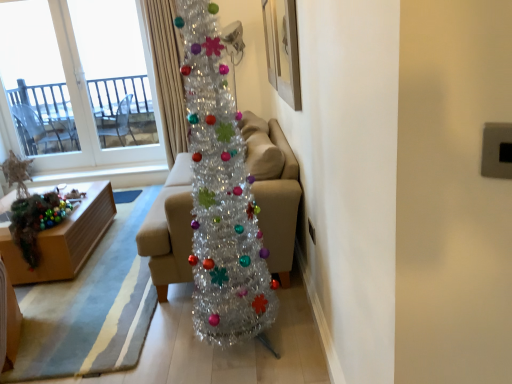
Question: Is beige fabric couch at center to the left of wooden picture frame at upper center from the viewer's perspective?

Choices:
 (A) no
 (B) yes

Answer: (B)

Question: Can you confirm if beige fabric couch at center is positioned to the right of wooden picture frame at upper center?

Choices:
 (A) yes
 (B) no

Answer: (B)

Question: Is beige fabric couch at center positioned beyond the bounds of wooden picture frame at upper center?

Choices:
 (A) no
 (B) yes

Answer: (B)

Question: Is beige fabric couch at center bigger than wooden picture frame at upper center?

Choices:
 (A) no
 (B) yes

Answer: (B)

Question: Does beige fabric couch at center contain wooden picture frame at upper center?

Choices:
 (A) yes
 (B) no

Answer: (B)

Question: In the image, is wooden picture frame at upper center positioned in front of or behind silky beige curtain at upper center?

Choices:
 (A) behind
 (B) front

Answer: (B)

Question: Visually, is wooden picture frame at upper center positioned to the left or to the right of silky beige curtain at upper center?

Choices:
 (A) right
 (B) left

Answer: (A)

Question: From the image's perspective, is wooden picture frame at upper center positioned above or below silky beige curtain at upper center?

Choices:
 (A) above
 (B) below

Answer: (B)

Question: Looking at the image, does wooden picture frame at upper center seem bigger or smaller compared to silky beige curtain at upper center?

Choices:
 (A) small
 (B) big

Answer: (A)

Question: Is point (272, 51) closer or farther from the camera than point (86, 248)?

Choices:
 (A) farther
 (B) closer

Answer: (B)

Question: Which is correct: wooden picture frame at upper center is inside wooden box at lower left, or outside of it?

Choices:
 (A) inside
 (B) outside

Answer: (B)

Question: Looking at the image, does wooden picture frame at upper center seem bigger or smaller compared to wooden box at lower left?

Choices:
 (A) big
 (B) small

Answer: (B)

Question: From a real-world perspective, is wooden picture frame at upper center positioned above or below wooden box at lower left?

Choices:
 (A) below
 (B) above

Answer: (B)

Question: Is transparent glass window at upper left spatially inside wooden picture frame at upper center, or outside of it?

Choices:
 (A) inside
 (B) outside

Answer: (B)

Question: From their relative heights in the image, would you say transparent glass window at upper left is taller or shorter than wooden picture frame at upper center?

Choices:
 (A) short
 (B) tall

Answer: (B)